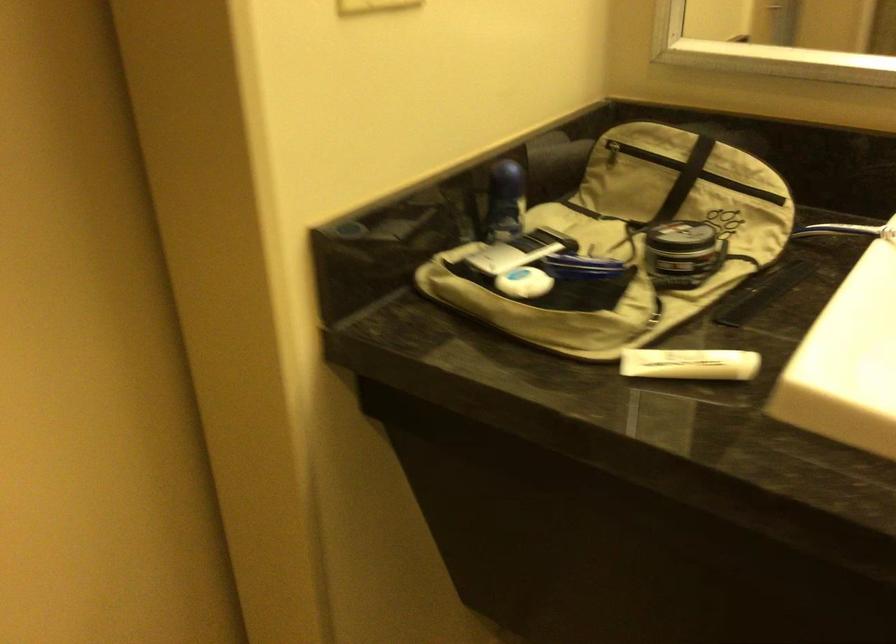
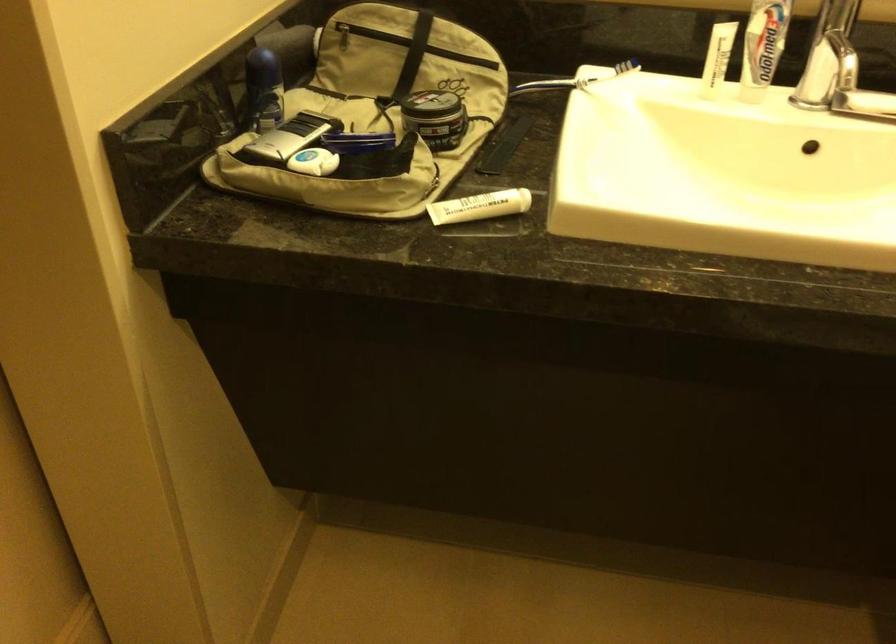
In the second image, find the point that corresponds to [502,198] in the first image.

(263, 88)